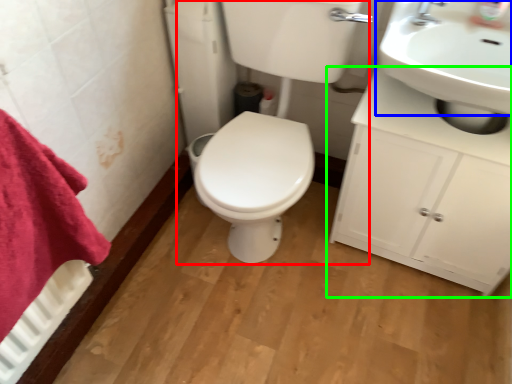
Question: Based on their relative distances, which object is farther from porcelain (highlighted by a red box)? Choose from sink (highlighted by a blue box) and bathroom cabinet (highlighted by a green box).

Choices:
 (A) sink
 (B) bathroom cabinet

Answer: (A)